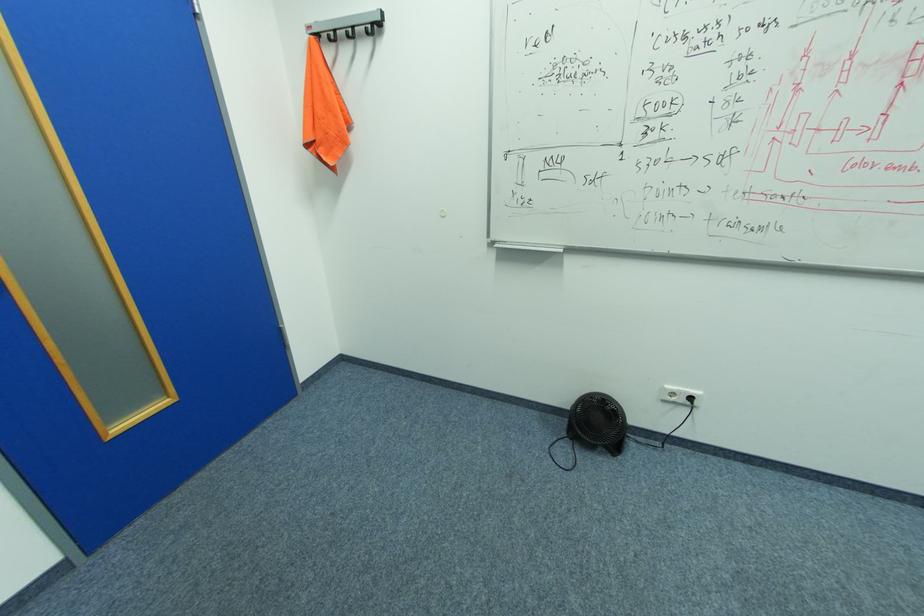
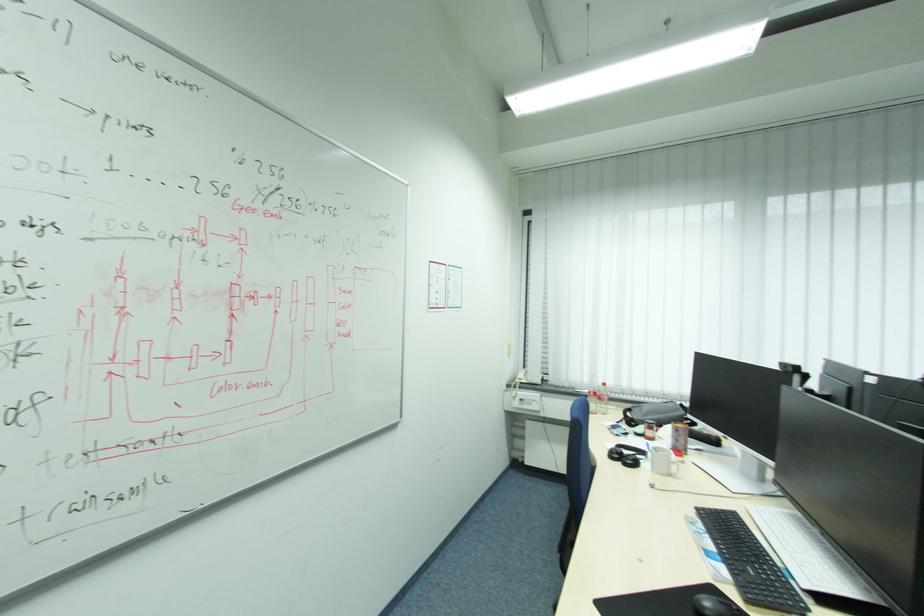
Question: The camera is either moving clockwise (left) or counter-clockwise (right) around the object. The first image is from the beginning of the video and the second image is from the end. Is the camera moving left or right when shooting the video?

Choices:
 (A) Left
 (B) Right

Answer: (A)